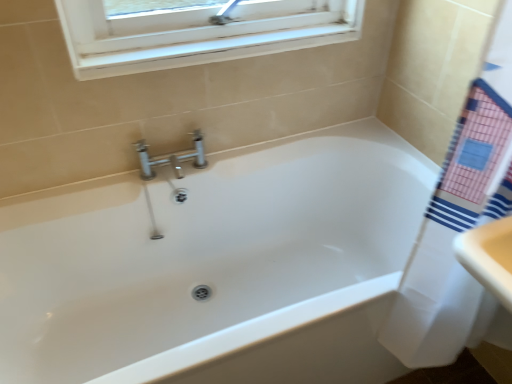
Describe the element at coordinates (218, 267) in the screenshot. I see `white glossy bathtub at center` at that location.

Locate an element on the screen. white glossy bathtub at center is located at coordinates (218, 267).

This screenshot has width=512, height=384. What do you see at coordinates (452, 240) in the screenshot?
I see `white fabric towel at right` at bounding box center [452, 240].

Locate an element on the screen. The height and width of the screenshot is (384, 512). white fabric towel at right is located at coordinates (452, 240).

The width and height of the screenshot is (512, 384). I want to click on white glossy bathtub at center, so tap(218, 267).

Which object is positioned more to the right, white glossy bathtub at center or white fabric towel at right?

From the viewer's perspective, white fabric towel at right appears more on the right side.

Which is behind, white glossy bathtub at center or white fabric towel at right?

white glossy bathtub at center is further from the camera.

Considering the positions of points (118, 193) and (420, 320), is point (118, 193) farther from camera compared to point (420, 320)?

Yes.

From the image's perspective, would you say white glossy bathtub at center is positioned over white fabric towel at right?

Yes.

From a real-world perspective, relative to white fabric towel at right, is white glossy bathtub at center vertically above or below?

white glossy bathtub at center is below white fabric towel at right.

Considering the relative sizes of white glossy bathtub at center and white fabric towel at right in the image provided, is white glossy bathtub at center thinner than white fabric towel at right?

Incorrect, the width of white glossy bathtub at center is not less than that of white fabric towel at right.

Can you confirm if white glossy bathtub at center is shorter than white fabric towel at right?

Correct, white glossy bathtub at center is not as tall as white fabric towel at right.

Is white glossy bathtub at center bigger than white fabric towel at right?

Indeed, white glossy bathtub at center has a larger size compared to white fabric towel at right.

Is white fabric towel at right a part of white glossy bathtub at center?

Definitely not — white fabric towel at right is not inside white glossy bathtub at center.

Is white glossy bathtub at center far from white fabric towel at right?

No, white glossy bathtub at center is not far away from white fabric towel at right.

Consider the image. Is white glossy bathtub at center turned away from white fabric towel at right?

No, white glossy bathtub at center is not facing the opposite direction of white fabric towel at right.

Based on the photo, what's the angular difference between white glossy bathtub at center and white fabric towel at right's facing directions?

There is a 89-degree angle between the facing directions of white glossy bathtub at center and white fabric towel at right.

Measure the distance between white glossy bathtub at center and white fabric towel at right.

white glossy bathtub at center is 25.01 inches from white fabric towel at right.

Find the location of a particular element. This screenshot has height=384, width=512. bathtub that appears below the white fabric towel at right (from a real-world perspective) is located at coordinates (218, 267).

Which object is positioned more to the right, white fabric towel at right or white glossy bathtub at center?

Positioned to the right is white fabric towel at right.

Who is more distant, white fabric towel at right or white glossy bathtub at center?

white glossy bathtub at center.

Considering the points (478, 95) and (296, 279), which point is behind, point (478, 95) or point (296, 279)?

The point (296, 279) is farther.

From the image's perspective, would you say white fabric towel at right is shown under white glossy bathtub at center?

Correct, white fabric towel at right appears lower than white glossy bathtub at center in the image.

From a real-world perspective, relative to white glossy bathtub at center, is white fabric towel at right vertically above or below?

From a real-world perspective, white fabric towel at right is physically above white glossy bathtub at center.

Does white fabric towel at right have a greater width compared to white glossy bathtub at center?

In fact, white fabric towel at right might be narrower than white glossy bathtub at center.

From their relative heights in the image, would you say white fabric towel at right is taller or shorter than white glossy bathtub at center?

Clearly, white fabric towel at right is taller compared to white glossy bathtub at center.

Is white fabric towel at right bigger or smaller than white glossy bathtub at center?

Clearly, white fabric towel at right is smaller in size than white glossy bathtub at center.

Choose the correct answer: Is white fabric towel at right inside white glossy bathtub at center or outside it?

white fabric towel at right lies outside white glossy bathtub at center.

Would you consider white fabric towel at right to be distant from white glossy bathtub at center?

That's not correct — white fabric towel at right is a little close to white glossy bathtub at center.

Is white fabric towel at right positioned with its back to white glossy bathtub at center?

No, white fabric towel at right is not facing away from white glossy bathtub at center.

What's the angular difference between white fabric towel at right and white glossy bathtub at center's facing directions?

89 degrees.

How far apart are white fabric towel at right and white glossy bathtub at center?

A distance of 25.01 inches exists between white fabric towel at right and white glossy bathtub at center.

The height and width of the screenshot is (384, 512). I want to click on bathtub that appears below the white fabric towel at right (from a real-world perspective), so click(218, 267).

The image size is (512, 384). I want to click on bathtub behind the white fabric towel at right, so click(218, 267).

Locate an element on the screen. The height and width of the screenshot is (384, 512). bath towel below the white glossy bathtub at center (from the image's perspective) is located at coordinates (452, 240).